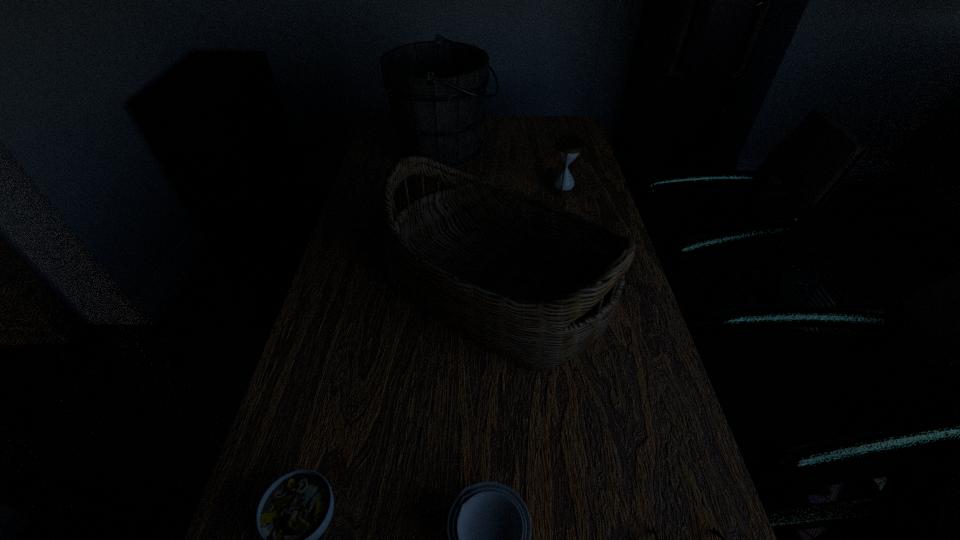
Locate which object ranks second in proximity to the right soup bowl. Please provide its 2D coordinates. Your answer should be formatted as a tuple, i.e. [(x, y)], where the tuple contains the x and y coordinates of a point satisfying the conditions above.

[(714, 531)]

Where is `vacant region that satisfies the following two spatial constraints: 1. on the handle side of the third farthest object; 2. on the left side of the farthest object`? This screenshot has height=540, width=960. vacant region that satisfies the following two spatial constraints: 1. on the handle side of the third farthest object; 2. on the left side of the farthest object is located at coordinates (429, 293).

Locate an element on the screen. This screenshot has width=960, height=540. vacant area that satisfies the following two spatial constraints: 1. on the back side of the fourth shortest object; 2. on the left side of the basket is located at coordinates (492, 190).

Find the location of `free space that satisfies the following two spatial constraints: 1. on the back side of the hourglass; 2. on the handle side of the tallest object`. free space that satisfies the following two spatial constraints: 1. on the back side of the hourglass; 2. on the handle side of the tallest object is located at coordinates (554, 150).

The width and height of the screenshot is (960, 540). What are the coordinates of `vacant space that satisfies the following two spatial constraints: 1. on the handle side of the fourth shortest object; 2. on the right side of the bucket` in the screenshot? It's located at (441, 190).